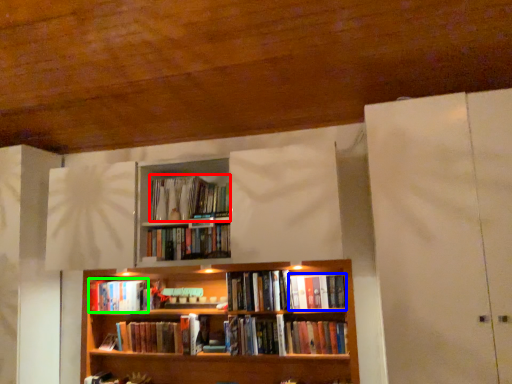
Question: Considering the real-world distances, which object is farthest from book (highlighted by a red box)? book (highlighted by a blue box) or book (highlighted by a green box)?

Choices:
 (A) book
 (B) book

Answer: (A)